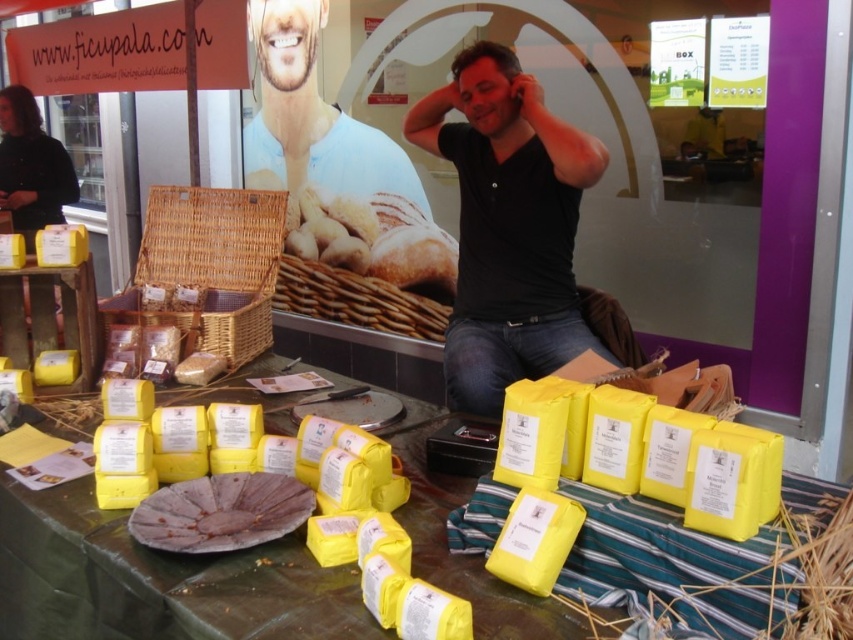
Does point (525, 602) come farther from viewer compared to point (576, 296)?

No, it is not.

Between yellow paper at center and black matte shirt at center, which one appears on the left side from the viewer's perspective?

Positioned to the left is yellow paper at center.

Image resolution: width=853 pixels, height=640 pixels. I want to click on yellow paper at center, so click(x=155, y=580).

Between smooth skin at upper center and woven brown basket at center, which one appears on the right side from the viewer's perspective?

woven brown basket at center

Is smooth skin at upper center taller than woven brown basket at center?

Yes, smooth skin at upper center is taller than woven brown basket at center.

This screenshot has height=640, width=853. What do you see at coordinates (314, 115) in the screenshot?
I see `smooth skin at upper center` at bounding box center [314, 115].

Find the location of `smooth skin at upper center`. smooth skin at upper center is located at coordinates (314, 115).

Looking at this image, who is taller, yellow paper at center or smooth skin at upper center?

Standing taller between the two is smooth skin at upper center.

Does yellow paper at center have a lesser height compared to smooth skin at upper center?

Yes.

Find the location of a particular element. yellow paper at center is located at coordinates (155, 580).

The height and width of the screenshot is (640, 853). Find the location of `yellow paper at center`. yellow paper at center is located at coordinates (155, 580).